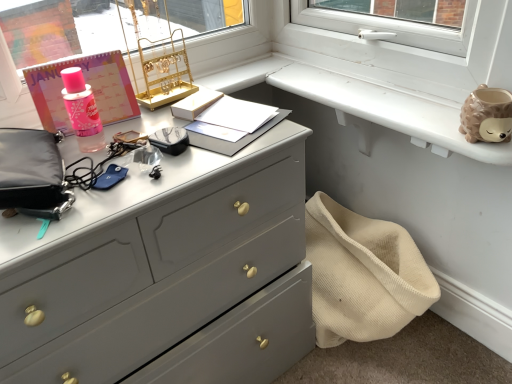
Image resolution: width=512 pixels, height=384 pixels. Find the location of `gold metallic jewelry stand at upper center`. gold metallic jewelry stand at upper center is located at coordinates (161, 68).

What is the approximate width of matte black pouch at left?

matte black pouch at left is 9.88 inches in width.

The width and height of the screenshot is (512, 384). What do you see at coordinates (387, 109) in the screenshot?
I see `white matte window sill at upper right` at bounding box center [387, 109].

Where is `gold metallic jewelry stand at upper center`? The width and height of the screenshot is (512, 384). gold metallic jewelry stand at upper center is located at coordinates (161, 68).

From a real-world perspective, is white matte window sill at upper right positioned over matte gray dresser at center based on gravity?

A: Yes, from a real-world perspective, white matte window sill at upper right is on top of matte gray dresser at center.

Can we say white matte window sill at upper right lies outside matte gray dresser at center?

Yes, white matte window sill at upper right is located beyond the bounds of matte gray dresser at center.

From the image's perspective, is white matte window sill at upper right over matte gray dresser at center?

Yes, from the image's perspective, white matte window sill at upper right is above matte gray dresser at center.

Is white matte window sill at upper right aimed at gold metallic jewelry stand at upper center?

No.

Is point (378, 120) more distant than point (123, 30)?

Yes, it is.

Does white matte window sill at upper right have a greater height compared to gold metallic jewelry stand at upper center?

Incorrect, the height of white matte window sill at upper right is not larger of that of gold metallic jewelry stand at upper center.

Is white matte window sill at upper right to the left or to the right of gold metallic jewelry stand at upper center in the image?

Clearly, white matte window sill at upper right is on the right of gold metallic jewelry stand at upper center in the image.

Is gold metallic jewelry stand at upper center at the back of matte black pouch at left?

That's not correct — matte black pouch at left is not looking away from gold metallic jewelry stand at upper center.

Is gold metallic jewelry stand at upper center inside matte black pouch at left?

No, gold metallic jewelry stand at upper center is not a part of matte black pouch at left.

Would you consider matte black pouch at left to be distant from gold metallic jewelry stand at upper center?

Actually, matte black pouch at left and gold metallic jewelry stand at upper center are a little close together.

Looking at this image, measure the distance from matte black pouch at left to gold metallic jewelry stand at upper center.

matte black pouch at left and gold metallic jewelry stand at upper center are 14.79 inches apart from each other.

From the image's perspective, between matte gray dresser at center and gold metallic jewelry stand at upper center, who is located below?

matte gray dresser at center is shown below in the image.

From a real-world perspective, is matte gray dresser at center over gold metallic jewelry stand at upper center?

Incorrect, from a real-world perspective, matte gray dresser at center is lower than gold metallic jewelry stand at upper center.

Between matte gray dresser at center and gold metallic jewelry stand at upper center, which one appears on the right side from the viewer's perspective?

From the viewer's perspective, gold metallic jewelry stand at upper center appears more on the right side.

Considering the sizes of objects matte black pouch at left and white matte window sill at upper right in the image provided, who is thinner, matte black pouch at left or white matte window sill at upper right?

With smaller width is matte black pouch at left.

Does matte black pouch at left turn towards white matte window sill at upper right?

No, matte black pouch at left is not facing towards white matte window sill at upper right.

There is a white matte window sill at upper right. At what (x,y) coordinates should I click in order to perform the action: click on pouch above it (from a real-world perspective). Please return your answer as a coordinate pair (x, y). Looking at the image, I should click on (30, 169).

From a real-world perspective, is matte black pouch at left on white matte window sill at upper right?

Indeed, from a real-world perspective, matte black pouch at left stands above white matte window sill at upper right.

Is matte gray dresser at center inside or outside of white matte window sill at upper right?

matte gray dresser at center cannot be found inside white matte window sill at upper right.

Which is more to the right, matte gray dresser at center or white matte window sill at upper right?

white matte window sill at upper right is more to the right.

From a real-world perspective, which is physically below, matte gray dresser at center or white matte window sill at upper right?

matte gray dresser at center, from a real-world perspective.

Is matte black pouch at left situated inside matte gray dresser at center or outside?

matte black pouch at left is not inside matte gray dresser at center, it's outside.

Is matte black pouch at left oriented towards matte gray dresser at center?

No, matte black pouch at left is not facing towards matte gray dresser at center.

Is matte black pouch at left thinner than matte gray dresser at center?

Correct, the width of matte black pouch at left is less than that of matte gray dresser at center.

Locate an element on the screen. window sill behind the matte gray dresser at center is located at coordinates (387, 109).

Find the location of a particular element. table lamp to the left of white matte window sill at upper right is located at coordinates (161, 68).

Based on their spatial positions, is matte black pouch at left or matte gray dresser at center further from gold metallic jewelry stand at upper center?

The object further to gold metallic jewelry stand at upper center is matte gray dresser at center.

Based on their spatial positions, is matte gray dresser at center or gold metallic jewelry stand at upper center further from white matte window sill at upper right?

matte gray dresser at center.

Looking at the image, which one is located further to matte gray dresser at center, matte black pouch at left or white matte window sill at upper right?

The object further to matte gray dresser at center is white matte window sill at upper right.

Considering their positions, is white matte window sill at upper right positioned further to matte black pouch at left than matte gray dresser at center?

The object further to matte black pouch at left is white matte window sill at upper right.

Looking at the image, which one is located further to matte gray dresser at center, gold metallic jewelry stand at upper center or white matte window sill at upper right?

Among the two, white matte window sill at upper right is located further to matte gray dresser at center.

When comparing their distances from white matte window sill at upper right, does matte black pouch at left or matte gray dresser at center seem closer?

matte gray dresser at center is closer to white matte window sill at upper right.

Based on the photo, based on their spatial positions, is gold metallic jewelry stand at upper center or matte gray dresser at center further from matte black pouch at left?

gold metallic jewelry stand at upper center.

Estimate the real-world distances between objects in this image. Which object is further from gold metallic jewelry stand at upper center, white matte window sill at upper right or matte gray dresser at center?

The object further to gold metallic jewelry stand at upper center is matte gray dresser at center.

Where is `chest of drawers between matte black pouch at left and white matte window sill at upper right in the horizontal direction`? chest of drawers between matte black pouch at left and white matte window sill at upper right in the horizontal direction is located at coordinates (153, 265).

Locate an element on the screen. This screenshot has height=384, width=512. pouch between gold metallic jewelry stand at upper center and matte gray dresser at center in the vertical direction is located at coordinates (30, 169).

Locate an element on the screen. table lamp between matte black pouch at left and white matte window sill at upper right is located at coordinates (161, 68).

Identify the location of table lamp between matte gray dresser at center and white matte window sill at upper right. (161, 68).